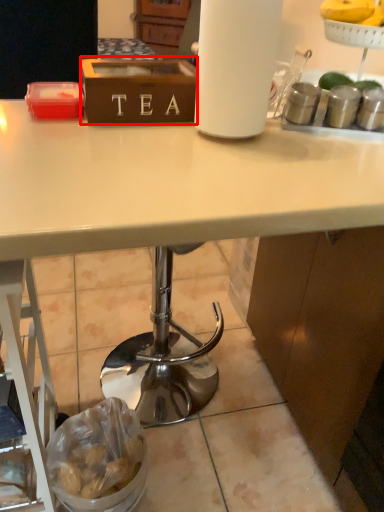
Question: Considering the relative positions of box (annotated by the red box) and food in the image provided, where is box (annotated by the red box) located with respect to the staircase?

Choices:
 (A) right
 (B) left

Answer: (A)